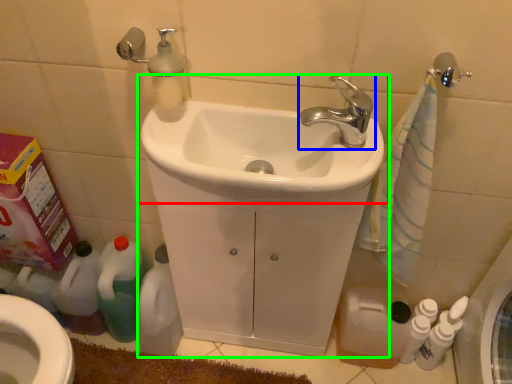
Question: Which is farther away from sink (highlighted by a red box)? tap (highlighted by a blue box) or sink (highlighted by a green box)?

Choices:
 (A) tap
 (B) sink

Answer: (A)